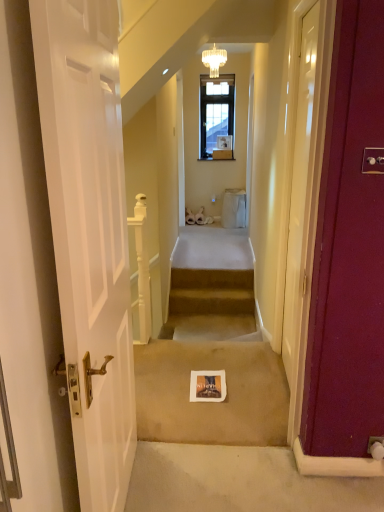
Question: Would you say white wooden door at left, which appears as the 2th door when viewed from the right, is to the left or to the right of gold textured chandelier at upper center in the picture?

Choices:
 (A) left
 (B) right

Answer: (A)

Question: From the image's perspective, relative to gold textured chandelier at upper center, is white wooden door at left, which is the first door from left to right, above or below?

Choices:
 (A) below
 (B) above

Answer: (A)

Question: Estimate the real-world distances between objects in this image. Which object is farther from the beige carpet at center?

Choices:
 (A) beige carpeted stairs at center
 (B) gold textured chandelier at upper center
 (C) white glossy door at right, the 2th door in the front-to-back sequence
 (D) white wooden door at left, which is the first door from left to right

Answer: (B)

Question: Which of these objects is positioned closest to the beige carpeted stairs at center?

Choices:
 (A) gold textured chandelier at upper center
 (B) white wooden door at left, which ranks as the first door in front-to-back order
 (C) white glossy door at right, the first door from the right
 (D) beige carpet at center

Answer: (D)